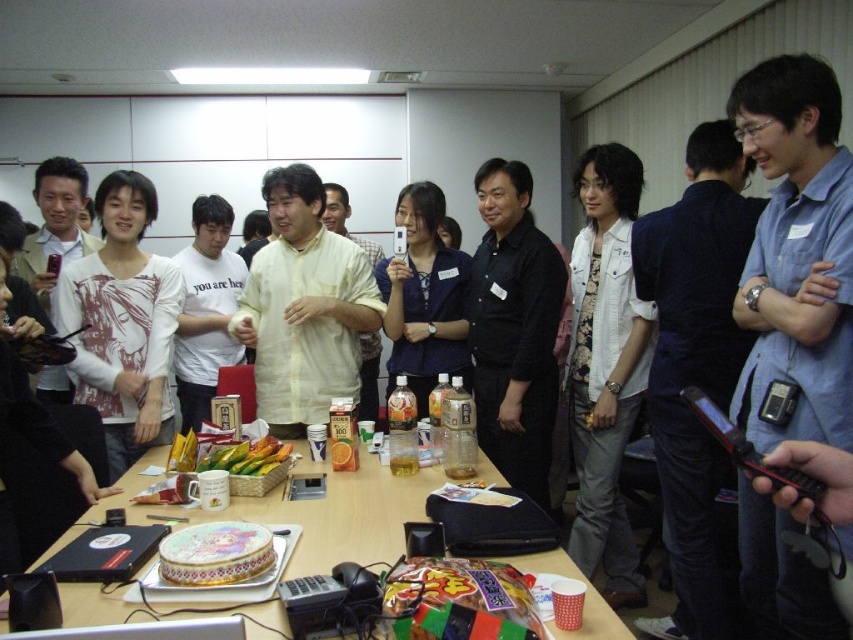
Question: Among these objects, which one is farthest from the camera?

Choices:
 (A) light yellow cotton shirt at center
 (B) white cotton t-shirt at center

Answer: (B)

Question: Is matte blue shirt at center to the right of decorative paper cake at center from the viewer's perspective?

Choices:
 (A) no
 (B) yes

Answer: (B)

Question: Which object is closer to the camera taking this photo?

Choices:
 (A) matte yellow shirt at center
 (B) blue shirt at center
 (C) black matte shirt at center
 (D) smooth wooden table at center

Answer: (D)

Question: Is white printed shirt at center wider than yellow matte bananas at center?

Choices:
 (A) no
 (B) yes

Answer: (B)

Question: Which of the following is the farthest from the observer?

Choices:
 (A) white cotton t-shirt at center
 (B) decorative paper cake at center
 (C) blue shirt at center
 (D) yellow matte bananas at center

Answer: (A)

Question: Is matte blue shirt at center closer to the viewer compared to decorative paper cake at center?

Choices:
 (A) yes
 (B) no

Answer: (B)